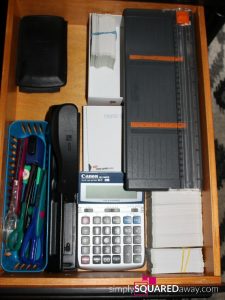
Where is `stapler`? This screenshot has width=225, height=300. stapler is located at coordinates (65, 162).